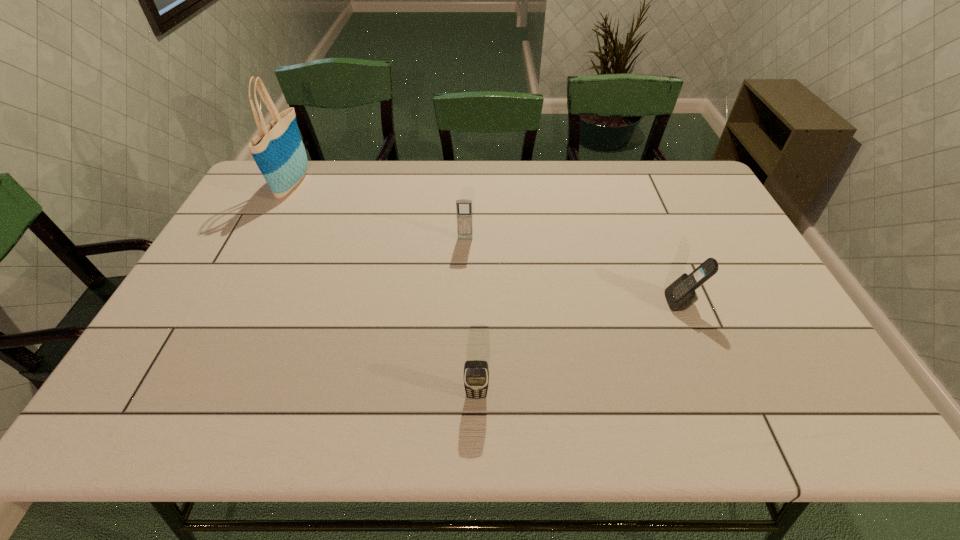
The height and width of the screenshot is (540, 960). I want to click on vacant area located on the front-facing side of the rightmost cellular telephone, so click(559, 302).

Where is `vacant position located 0.360m on the front-facing side of the rightmost cellular telephone`? This screenshot has height=540, width=960. vacant position located 0.360m on the front-facing side of the rightmost cellular telephone is located at coordinates (528, 302).

Identify the location of object at the far edge. (278, 150).

Locate an element on the screen. This screenshot has width=960, height=540. object positioned at the near edge is located at coordinates (476, 373).

Where is `object positioned at the left edge`? This screenshot has width=960, height=540. object positioned at the left edge is located at coordinates (278, 150).

This screenshot has width=960, height=540. Find the location of `object located at the far left corner`. object located at the far left corner is located at coordinates (278, 150).

In the image, there is a desktop. Identify the location of vacant area at the far edge. Image resolution: width=960 pixels, height=540 pixels. (372, 187).

This screenshot has width=960, height=540. In order to click on vacant space at the near edge of the desktop in this screenshot , I will do click(x=300, y=395).

Identify the location of vacant region at the left edge of the desktop. The height and width of the screenshot is (540, 960). (178, 377).

Where is `vacant space at the right edge of the desktop`? The height and width of the screenshot is (540, 960). vacant space at the right edge of the desktop is located at coordinates (680, 202).